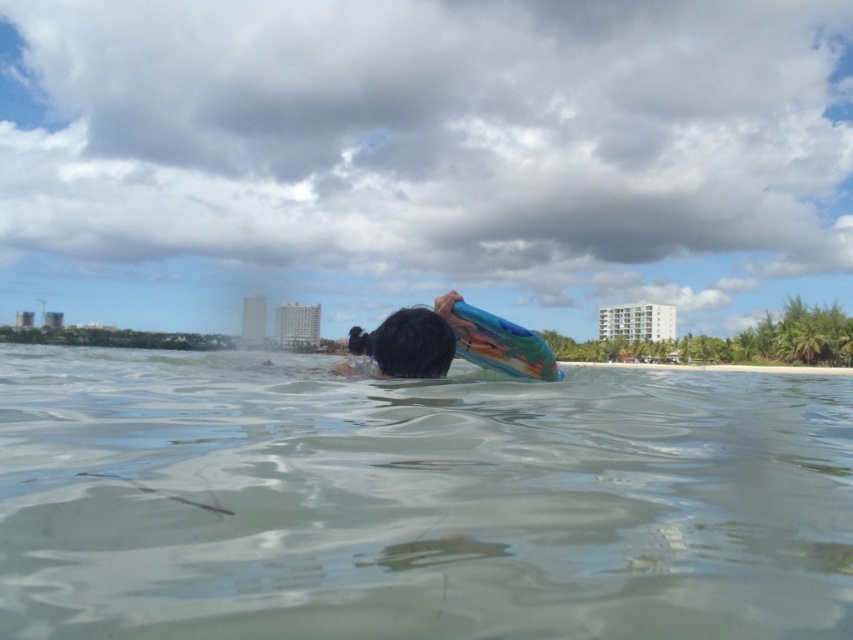
You are a beach lifeguard who needs to ensure safety. You see the clear water at center and the smooth blue surfboard at center. Which object is bigger in size?

The clear water at center is larger in size compared to the smooth blue surfboard at center.

You are a lifeguard on duty and notice a swimmer holding a colorful toy in the clear water at center and a smooth blue surfboard at center. Which object is taller when viewed from above?

The clear water at center has a greater height compared to the smooth blue surfboard at center, so the clear water at center is taller when viewed from above.

You are a beach lifeguard who needs to locate the smooth blue surfboard at center and the clear water at center. According to the scene, which object is positioned to the right?

The smooth blue surfboard at center is positioned to the right of the clear water at center.